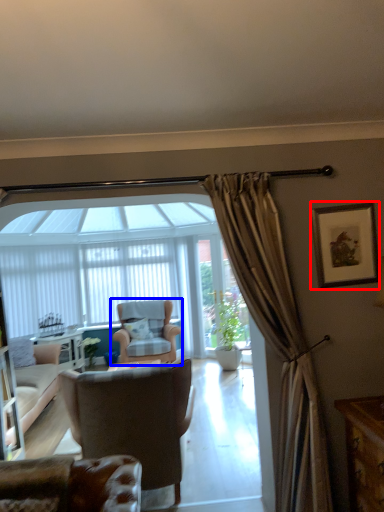
Question: Which of the following is the farthest to the observer, picture frame (highlighted by a red box) or chair (highlighted by a blue box)?

Choices:
 (A) picture frame
 (B) chair

Answer: (B)